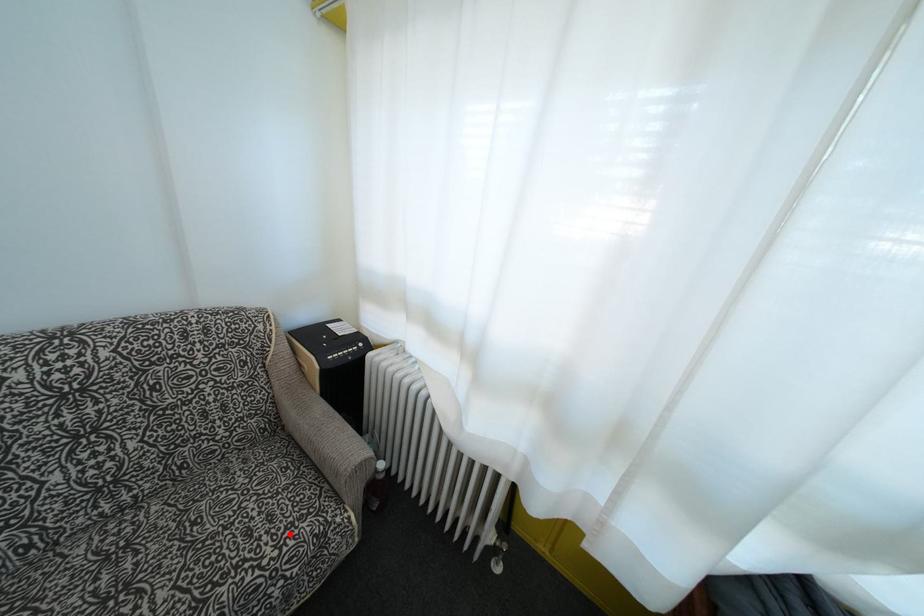
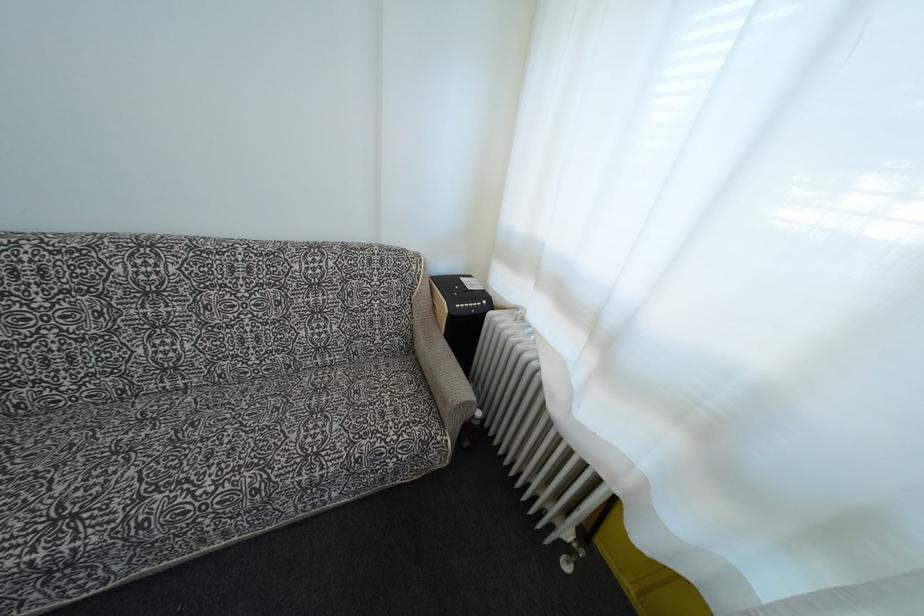
In the second image, find the point that corresponds to the highlighted location in the first image.

(407, 430)